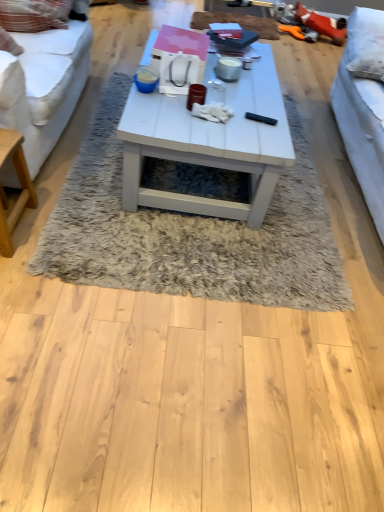
Question: From the image's perspective, is light brown wooden table at left located above or below white matte coffee table at center?

Choices:
 (A) above
 (B) below

Answer: (B)

Question: From a real-world perspective, is light brown wooden table at left physically located above or below white matte coffee table at center?

Choices:
 (A) below
 (B) above

Answer: (A)

Question: Which is nearer to the light brown wooden table at left?

Choices:
 (A) white fabric studio couch at left, arranged as the 2th studio couch when viewed from the right
 (B) white shaggy rug at center
 (C) white fabric couch at right, positioned as the first studio couch in right-to-left order
 (D) white matte coffee table at center

Answer: (A)

Question: Based on their relative distances, which object is nearer to the white shaggy rug at center?

Choices:
 (A) light brown wooden table at left
 (B) white fabric studio couch at left, arranged as the 2th studio couch when viewed from the right
 (C) white fabric couch at right, positioned as the first studio couch in right-to-left order
 (D) white matte coffee table at center

Answer: (D)